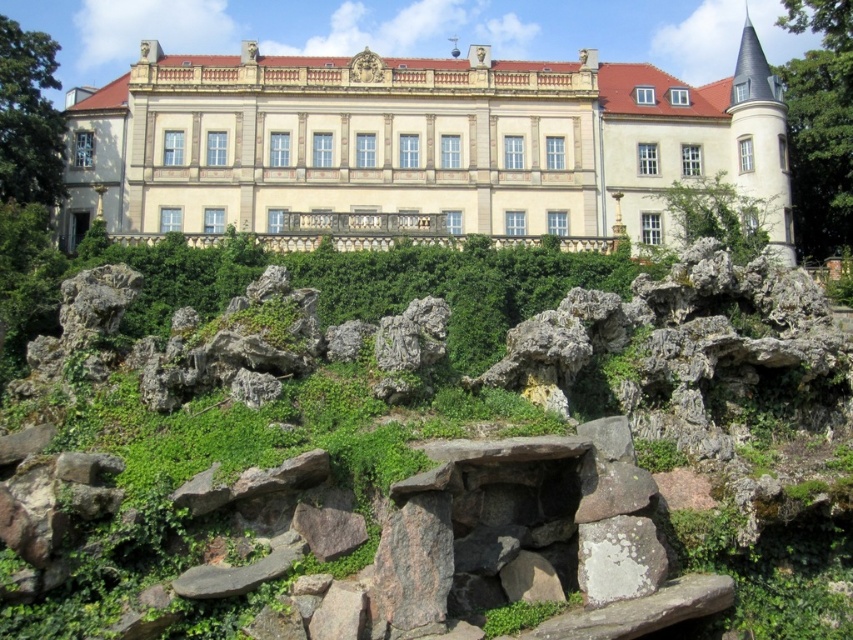
You are a visitor standing in front of the beige stone palace at center. You notice some green mossy rocks at center nearby. Are the rocks located directly in front of or behind the palace?

The green mossy rocks at center are positioned under the beige stone palace at center, so they are located directly in front of the palace.